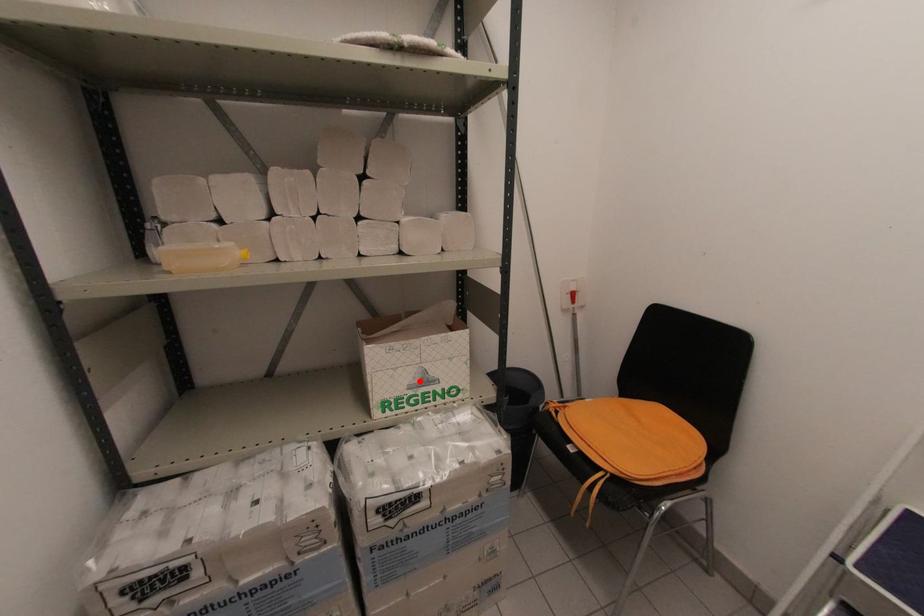
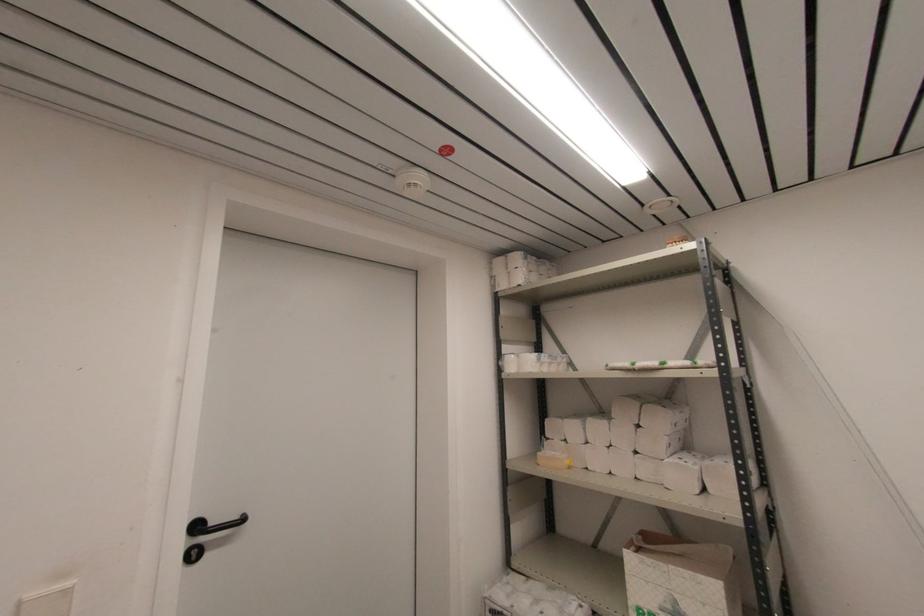
Find the pixel in the second image that matches the highlighted location in the first image.

(671, 609)